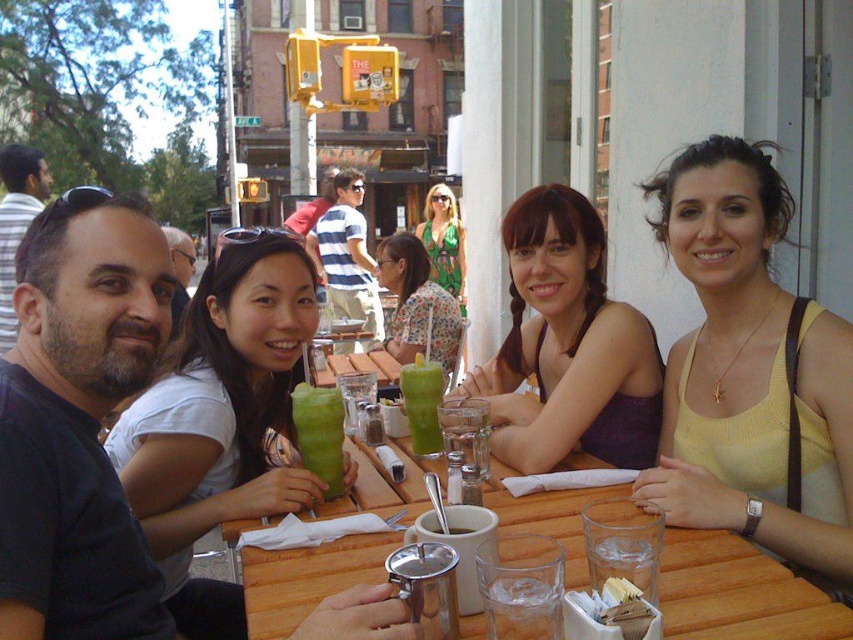
Which is more to the left, green matte smoothie at center or green floral dress at center?

green matte smoothie at center

Is green matte smoothie at center positioned behind green floral dress at center?

That is False.

I want to click on green matte smoothie at center, so click(x=320, y=433).

At what (x,y) coordinates should I click in order to perform the action: click on green matte smoothie at center. Please return your answer as a coordinate pair (x, y). The image size is (853, 640). Looking at the image, I should click on (320, 433).

Is wooden table at center behind matte black shirt at left?

No, wooden table at center is in front of matte black shirt at left.

Who is more forward, (335, 579) or (177, 317)?

Positioned in front is point (335, 579).

Describe the element at coordinates (738, 595) in the screenshot. The height and width of the screenshot is (640, 853). I see `wooden table at center` at that location.

You are a GUI agent. You are given a task and a screenshot of the screen. Output one action in this format:
    pyautogui.click(x=<x>, y=<y>)
    Task: Click on the wooden table at center
    This screenshot has width=853, height=640.
    Given the screenshot: What is the action you would take?
    pyautogui.click(x=738, y=595)

Is wooden table at center thinner than red shirt at center?

Yes, wooden table at center is thinner than red shirt at center.

Does wooden table at center appear over red shirt at center?

No, wooden table at center is not above red shirt at center.

Is point (730, 625) positioned in front of point (323, 186)?

Yes, point (730, 625) is closer to viewer.

Locate an element on the screen. This screenshot has height=640, width=853. wooden table at center is located at coordinates (738, 595).